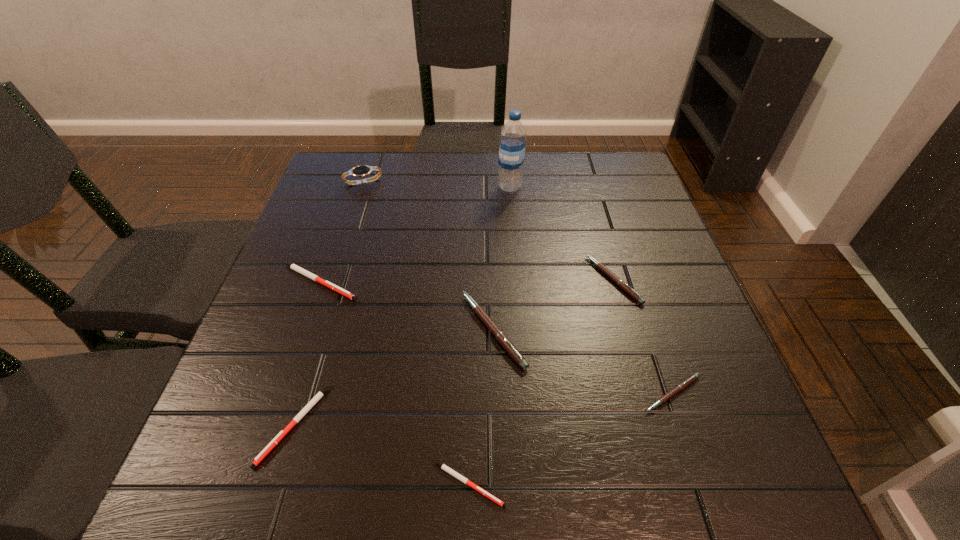
Locate an element on the screen. free spot located at the nib of the second biggest pink pen is located at coordinates (470, 280).

Find the location of a particular element. This screenshot has width=960, height=540. vacant space located 0.120m at the nib of the second biggest pink pen is located at coordinates (538, 280).

Where is `free space located 0.200m on the clicker of the biggest white pen`? free space located 0.200m on the clicker of the biggest white pen is located at coordinates (451, 282).

I want to click on vacant space located 0.050m at the nib of the nearest pink pen, so click(688, 441).

In order to click on vacant area located on the clicker of the shortest pen in this screenshot , I will do pyautogui.click(x=583, y=484).

I want to click on water bottle that is at the far edge, so click(513, 134).

Find the location of a particular element. The height and width of the screenshot is (540, 960). watch present at the far edge is located at coordinates (359, 171).

Locate an element on the screen. This screenshot has height=540, width=960. watch situated at the left edge is located at coordinates (359, 171).

At what (x,y) coordinates should I click in order to perform the action: click on object that is at the far left corner. Please return your answer as a coordinate pair (x, y). Looking at the image, I should click on (359, 171).

The height and width of the screenshot is (540, 960). I want to click on object present at the near left corner, so click(318, 396).